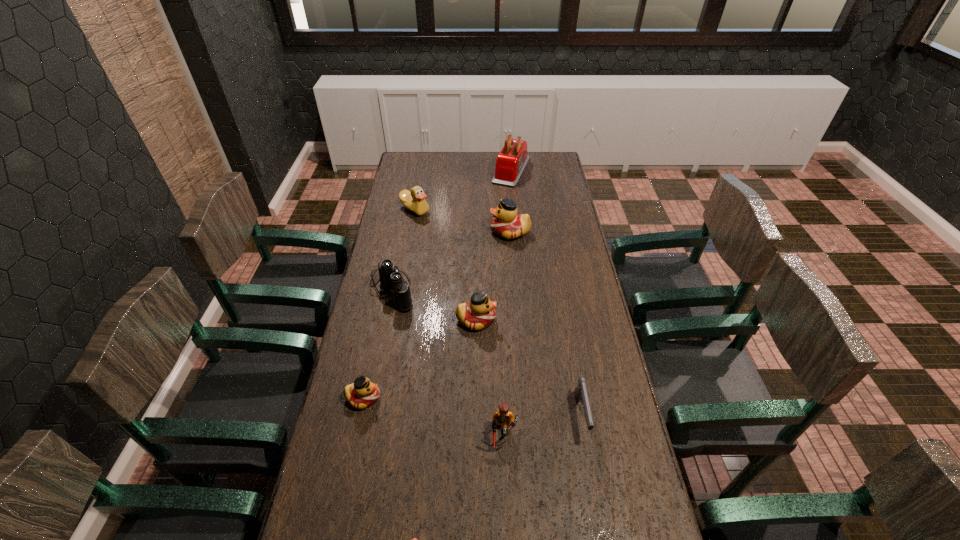
Identify the location of vacant space positioned 0.180m holding a crossbow in the hands of the Lego. The image size is (960, 540). (502, 523).

The image size is (960, 540). In order to click on vacant space located at the barrel of the rightmost object in this screenshot , I will do `click(593, 488)`.

Image resolution: width=960 pixels, height=540 pixels. What are the coordinates of `vacant area located on the face of the smallest red duck` in the screenshot? It's located at (423, 398).

Find the location of a particular element. object present at the far edge is located at coordinates (511, 161).

In order to click on binoculars situated at the left edge in this screenshot , I will do `click(391, 278)`.

I want to click on toaster located at the right edge, so click(511, 161).

Identify the location of pistol situated at the right edge. This screenshot has height=540, width=960. (580, 393).

The height and width of the screenshot is (540, 960). In order to click on object that is at the far right corner in this screenshot , I will do `click(511, 161)`.

The height and width of the screenshot is (540, 960). In order to click on free space at the far edge in this screenshot , I will do `click(465, 152)`.

Where is `vacant area at the left edge`? This screenshot has width=960, height=540. vacant area at the left edge is located at coordinates (397, 321).